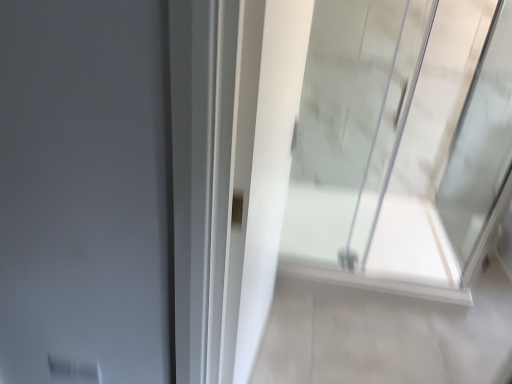
Question: From a real-world perspective, is white glossy shower door at center physically located above or below transparent glass shower door at right?

Choices:
 (A) above
 (B) below

Answer: (B)

Question: Considering the positions of point (486, 342) and point (401, 61), is point (486, 342) closer or farther from the camera than point (401, 61)?

Choices:
 (A) closer
 (B) farther

Answer: (A)

Question: In terms of width, does white glossy shower door at center look wider or thinner when compared to transparent glass shower door at right?

Choices:
 (A) wide
 (B) thin

Answer: (A)

Question: From the image's perspective, relative to white glossy shower door at center, is transparent glass shower door at right above or below?

Choices:
 (A) below
 (B) above

Answer: (B)

Question: Is transparent glass shower door at right taller or shorter than white glossy shower door at center?

Choices:
 (A) tall
 (B) short

Answer: (A)

Question: Considering the positions of point (318, 23) and point (456, 374), is point (318, 23) closer or farther from the camera than point (456, 374)?

Choices:
 (A) closer
 (B) farther

Answer: (A)

Question: Is transparent glass shower door at right spatially inside white glossy shower door at center, or outside of it?

Choices:
 (A) inside
 (B) outside

Answer: (B)